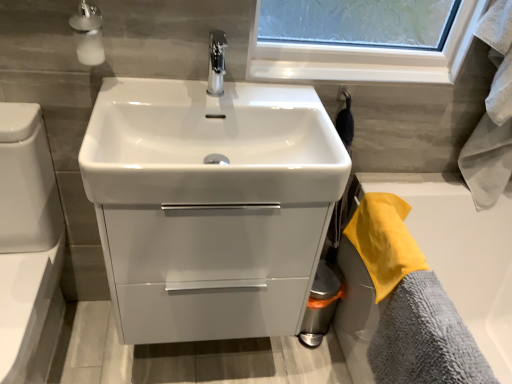
Question: Should I look upward or downward to see yellow terry cloth towel at right, placed as the 2th bath towel when sorted from bottom to top?

Choices:
 (A) down
 (B) up

Answer: (A)

Question: Considering the relative positions of gray microfiber towel at lower right, marked as the 1th bath towel in a bottom-to-top arrangement, and white glossy toilet bowl at lower left in the image provided, is gray microfiber towel at lower right, marked as the 1th bath towel in a bottom-to-top arrangement, to the left of white glossy toilet bowl at lower left from the viewer's perspective?

Choices:
 (A) yes
 (B) no

Answer: (B)

Question: Is gray microfiber towel at lower right, marked as the 1th bath towel in a bottom-to-top arrangement, behind white glossy toilet bowl at lower left?

Choices:
 (A) yes
 (B) no

Answer: (A)

Question: Is gray microfiber towel at lower right, the 2th bath towel from the top, bigger than white glossy toilet bowl at lower left?

Choices:
 (A) yes
 (B) no

Answer: (B)

Question: From the image's perspective, does gray microfiber towel at lower right, the 2th bath towel from the top, appear lower than white glossy toilet bowl at lower left?

Choices:
 (A) yes
 (B) no

Answer: (A)

Question: From a real-world perspective, is gray microfiber towel at lower right, marked as the 1th bath towel in a bottom-to-top arrangement, physically above white glossy toilet bowl at lower left?

Choices:
 (A) no
 (B) yes

Answer: (B)

Question: Is gray microfiber towel at lower right, the 2th bath towel from the top, facing towards white glossy toilet bowl at lower left?

Choices:
 (A) no
 (B) yes

Answer: (B)

Question: Is satin glass soap dispenser at upper left at the left side of gray microfiber towel at lower right, the 2th bath towel from the top?

Choices:
 (A) yes
 (B) no

Answer: (A)

Question: Is satin glass soap dispenser at upper left taller than gray microfiber towel at lower right, marked as the 1th bath towel in a bottom-to-top arrangement?

Choices:
 (A) no
 (B) yes

Answer: (A)

Question: Is satin glass soap dispenser at upper left oriented away from gray microfiber towel at lower right, marked as the 1th bath towel in a bottom-to-top arrangement?

Choices:
 (A) no
 (B) yes

Answer: (A)

Question: Does satin glass soap dispenser at upper left have a lesser width compared to gray microfiber towel at lower right, the 2th bath towel from the top?

Choices:
 (A) yes
 (B) no

Answer: (A)

Question: From the image's perspective, is satin glass soap dispenser at upper left beneath gray microfiber towel at lower right, the 2th bath towel from the top?

Choices:
 (A) no
 (B) yes

Answer: (A)

Question: Considering the relative sizes of satin glass soap dispenser at upper left and gray microfiber towel at lower right, the 2th bath towel from the top, in the image provided, is satin glass soap dispenser at upper left bigger than gray microfiber towel at lower right, the 2th bath towel from the top,?

Choices:
 (A) no
 (B) yes

Answer: (A)

Question: Can you confirm if yellow terry cloth towel at right, which appears as the 1th bath towel when viewed from the top, is shorter than gray microfiber towel at lower right, marked as the 1th bath towel in a bottom-to-top arrangement?

Choices:
 (A) no
 (B) yes

Answer: (B)